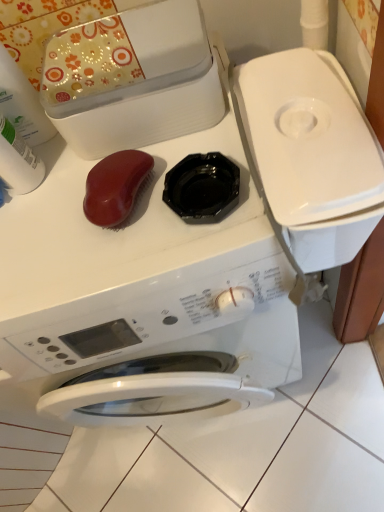
Measure the distance between point (36,182) and camera.

The depth of point (36,182) is 60.10 centimeters.

Find the location of a particular element. This screenshot has height=512, width=384. white glossy washing machine at center is located at coordinates (144, 296).

Can you confirm if white plastic bottle at upper left, which ranks as the second cleaning product in bottom-to-top order, is bigger than white plastic bottle at left, placed as the 1th cleaning product when sorted from bottom to top?

Yes, white plastic bottle at upper left, which ranks as the second cleaning product in bottom-to-top order, is bigger than white plastic bottle at left, placed as the 1th cleaning product when sorted from bottom to top.

How many degrees apart are the facing directions of white plastic bottle at upper left, which ranks as the second cleaning product in bottom-to-top order, and white plastic bottle at left, marked as the 2th cleaning product in a top-to-bottom arrangement?

white plastic bottle at upper left, which ranks as the second cleaning product in bottom-to-top order, and white plastic bottle at left, marked as the 2th cleaning product in a top-to-bottom arrangement, are facing 0.00133 degrees away from each other.

Who is more distant, white plastic bottle at upper left, which is the 1th cleaning product from top to bottom, or white plastic bottle at left, marked as the 2th cleaning product in a top-to-bottom arrangement?

white plastic bottle at left, marked as the 2th cleaning product in a top-to-bottom arrangement, is behind.

Where is `cleaning product in front of the white plastic bottle at left, placed as the 1th cleaning product when sorted from bottom to top`? This screenshot has height=512, width=384. cleaning product in front of the white plastic bottle at left, placed as the 1th cleaning product when sorted from bottom to top is located at coordinates [x=22, y=103].

Consider the image. From a real-world perspective, is white glossy washing machine at center above or below white plastic bottle at upper left, which is the 1th cleaning product from top to bottom?

In terms of real-world spatial position, white glossy washing machine at center is below white plastic bottle at upper left, which is the 1th cleaning product from top to bottom.

From the image's perspective, which is below, white glossy washing machine at center or white plastic bottle at upper left, which is the 1th cleaning product from top to bottom?

white glossy washing machine at center appears lower in the image.

Is white glossy washing machine at center inside the boundaries of white plastic bottle at upper left, which is the 1th cleaning product from top to bottom, or outside?

white glossy washing machine at center exists outside the volume of white plastic bottle at upper left, which is the 1th cleaning product from top to bottom.

Is white plastic bottle at left, marked as the 2th cleaning product in a top-to-bottom arrangement, with white plastic bottle at upper left, which is the 1th cleaning product from top to bottom?

Yes, white plastic bottle at left, marked as the 2th cleaning product in a top-to-bottom arrangement, is right next to white plastic bottle at upper left, which is the 1th cleaning product from top to bottom, and making contact.

Which point is more distant from viewer, (x=1, y=172) or (x=28, y=101)?

The point (x=28, y=101) is farther.

Which of these two, white plastic bottle at left, placed as the 1th cleaning product when sorted from bottom to top, or white plastic bottle at upper left, which is the 1th cleaning product from top to bottom, stands taller?

white plastic bottle at upper left, which is the 1th cleaning product from top to bottom.

Considering the relative positions of white plastic bottle at left, placed as the 1th cleaning product when sorted from bottom to top, and white plastic bottle at upper left, which is the 1th cleaning product from top to bottom, in the image provided, is white plastic bottle at left, placed as the 1th cleaning product when sorted from bottom to top, to the left of white plastic bottle at upper left, which is the 1th cleaning product from top to bottom, from the viewer's perspective?

No, white plastic bottle at left, placed as the 1th cleaning product when sorted from bottom to top, is not to the left of white plastic bottle at upper left, which is the 1th cleaning product from top to bottom.

In the scene shown: Is white plastic bottle at upper left, which ranks as the second cleaning product in bottom-to-top order, facing away from white glossy washing machine at center?

No, white plastic bottle at upper left, which ranks as the second cleaning product in bottom-to-top order, is not facing away from white glossy washing machine at center.

Who is shorter, white plastic bottle at upper left, which ranks as the second cleaning product in bottom-to-top order, or white glossy washing machine at center?

Standing shorter between the two is white plastic bottle at upper left, which ranks as the second cleaning product in bottom-to-top order.

From the image's perspective, which object appears higher, white plastic bottle at upper left, which ranks as the second cleaning product in bottom-to-top order, or white glossy washing machine at center?

white plastic bottle at upper left, which ranks as the second cleaning product in bottom-to-top order, is shown above in the image.

Considering the sizes of white plastic bottle at upper left, which is the 1th cleaning product from top to bottom, and white glossy washing machine at center in the image, is white plastic bottle at upper left, which is the 1th cleaning product from top to bottom, wider or thinner than white glossy washing machine at center?

Clearly, white plastic bottle at upper left, which is the 1th cleaning product from top to bottom, has less width compared to white glossy washing machine at center.

Is white glossy washing machine at center located outside white plastic bottle at left, placed as the 1th cleaning product when sorted from bottom to top?

Yes, white glossy washing machine at center is not within white plastic bottle at left, placed as the 1th cleaning product when sorted from bottom to top.

Is white glossy washing machine at center looking in the opposite direction of white plastic bottle at left, marked as the 2th cleaning product in a top-to-bottom arrangement?

No, white glossy washing machine at center is not facing away from white plastic bottle at left, marked as the 2th cleaning product in a top-to-bottom arrangement.

Looking at this image, is white glossy washing machine at center to the left of white plastic bottle at left, marked as the 2th cleaning product in a top-to-bottom arrangement, from the viewer's perspective?

No.

From a real-world perspective, is white glossy washing machine at center on white plastic bottle at left, placed as the 1th cleaning product when sorted from bottom to top?

Actually, white glossy washing machine at center is physically below white plastic bottle at left, placed as the 1th cleaning product when sorted from bottom to top, in the real world.

In terms of height, does white plastic bottle at left, placed as the 1th cleaning product when sorted from bottom to top, look taller or shorter compared to white glossy washing machine at center?

In the image, white plastic bottle at left, placed as the 1th cleaning product when sorted from bottom to top, appears to be shorter than white glossy washing machine at center.

Considering the relative sizes of white plastic bottle at left, placed as the 1th cleaning product when sorted from bottom to top, and white glossy washing machine at center in the image provided, is white plastic bottle at left, placed as the 1th cleaning product when sorted from bottom to top, bigger than white glossy washing machine at center?

Incorrect, white plastic bottle at left, placed as the 1th cleaning product when sorted from bottom to top, is not larger than white glossy washing machine at center.

Which object is further away from the camera taking this photo, white plastic bottle at left, marked as the 2th cleaning product in a top-to-bottom arrangement, or white glossy washing machine at center?

white plastic bottle at left, marked as the 2th cleaning product in a top-to-bottom arrangement, is further from the camera.

Is point (20, 167) closer to camera compared to point (257, 390)?

Yes, point (20, 167) is closer to viewer.

Where is `cleaning product directly beneath the white plastic bottle at upper left, which ranks as the second cleaning product in bottom-to-top order (from a real-world perspective)`? This screenshot has width=384, height=512. cleaning product directly beneath the white plastic bottle at upper left, which ranks as the second cleaning product in bottom-to-top order (from a real-world perspective) is located at coordinates (18, 161).

What are the coordinates of `the 2nd cleaning product to the left of the white glossy washing machine at center, starting your count from the anchor` in the screenshot? It's located at (22, 103).

When comparing their distances from white glossy washing machine at center, does white plastic bottle at left, marked as the 2th cleaning product in a top-to-bottom arrangement, or white plastic bottle at upper left, which ranks as the second cleaning product in bottom-to-top order, seem further?

Based on the image, white plastic bottle at upper left, which ranks as the second cleaning product in bottom-to-top order, appears to be further to white glossy washing machine at center.

When comparing their distances from white glossy washing machine at center, does white plastic bottle at upper left, which is the 1th cleaning product from top to bottom, or white plastic bottle at left, marked as the 2th cleaning product in a top-to-bottom arrangement, seem closer?

white plastic bottle at left, marked as the 2th cleaning product in a top-to-bottom arrangement, lies closer to white glossy washing machine at center than the other object.

Which object lies nearer to the anchor point white plastic bottle at left, placed as the 1th cleaning product when sorted from bottom to top, white plastic bottle at upper left, which is the 1th cleaning product from top to bottom, or white glossy washing machine at center?

The object closer to white plastic bottle at left, placed as the 1th cleaning product when sorted from bottom to top, is white plastic bottle at upper left, which is the 1th cleaning product from top to bottom.

Considering their positions, is white glossy washing machine at center positioned further to white plastic bottle at left, placed as the 1th cleaning product when sorted from bottom to top, than white plastic bottle at upper left, which is the 1th cleaning product from top to bottom?

white glossy washing machine at center lies further to white plastic bottle at left, placed as the 1th cleaning product when sorted from bottom to top, than the other object.

Considering their positions, is white glossy washing machine at center positioned further to white plastic bottle at upper left, which ranks as the second cleaning product in bottom-to-top order, than white plastic bottle at left, marked as the 2th cleaning product in a top-to-bottom arrangement?

Among the two, white glossy washing machine at center is located further to white plastic bottle at upper left, which ranks as the second cleaning product in bottom-to-top order.

Considering their positions, is white plastic bottle at left, placed as the 1th cleaning product when sorted from bottom to top, positioned further to white plastic bottle at upper left, which is the 1th cleaning product from top to bottom, than white glossy washing machine at center?

white glossy washing machine at center is positioned further to the anchor white plastic bottle at upper left, which is the 1th cleaning product from top to bottom.

Where is `cleaning product between white plastic bottle at upper left, which is the 1th cleaning product from top to bottom, and white glossy washing machine at center, in the vertical direction`? cleaning product between white plastic bottle at upper left, which is the 1th cleaning product from top to bottom, and white glossy washing machine at center, in the vertical direction is located at coordinates (18, 161).